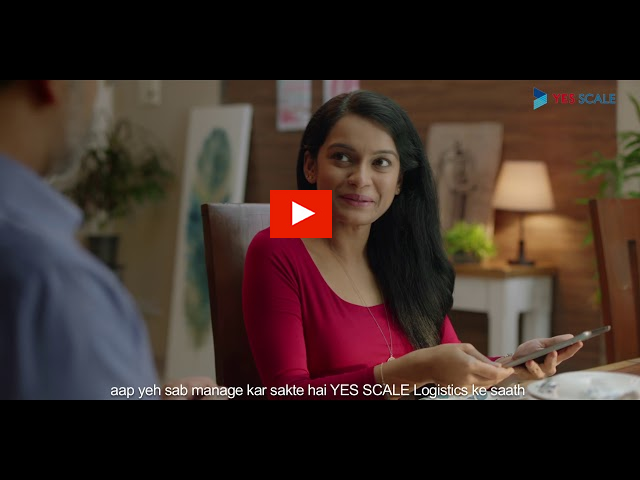
At what (x,y) coordinates should I click in order to perform the action: click on the back of chair. Please return your answer as a coordinate pair (x, y). Looking at the image, I should click on (612, 217), (226, 225).